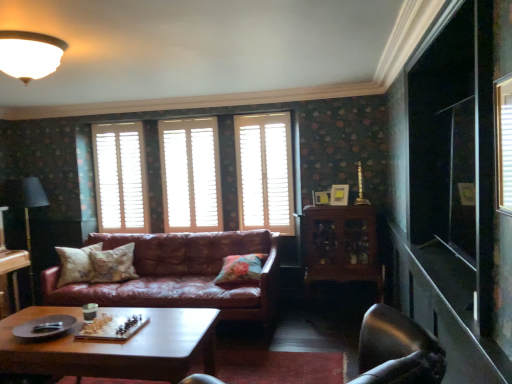
Locate an element on the screen. The height and width of the screenshot is (384, 512). empty space that is to the right of wooden chess set at center is located at coordinates (169, 331).